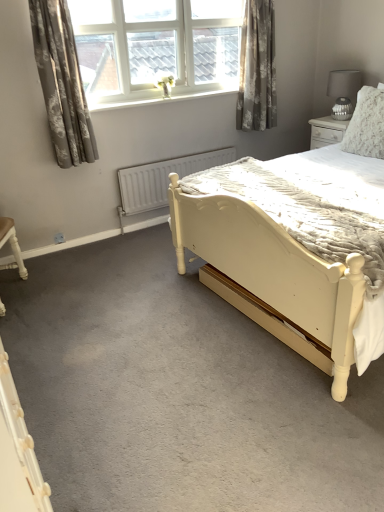
At what (x,y) coordinates should I click in order to perform the action: click on vacant point above white glossy window sill at upper center (from a real-world perspective). Please return your answer as a coordinate pair (x, y). Looking at the image, I should click on (170, 95).